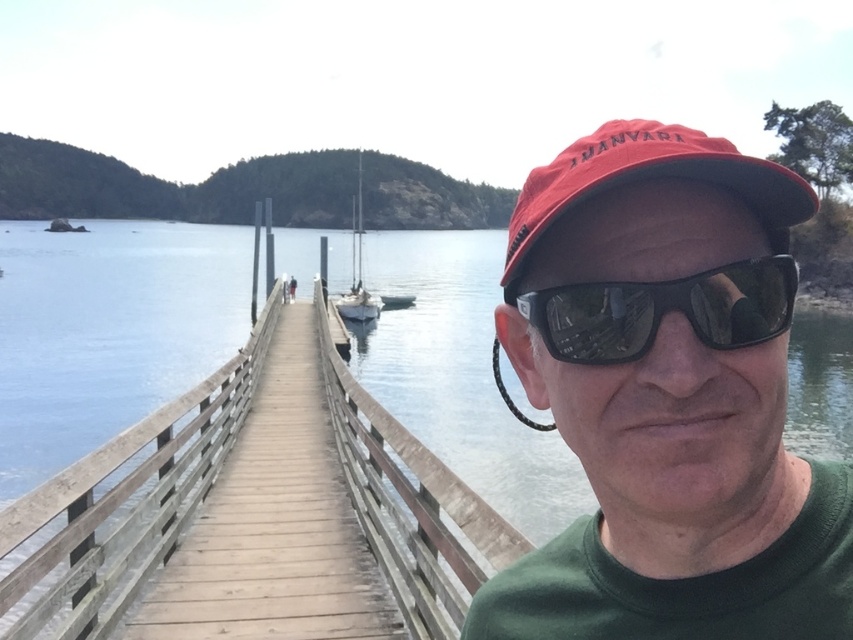
You are a photographer planning to take a photo of the red matte cap at center and the white matte sailboat at center. Which object should you focus on first if you want to capture both in the same frame without moving the camera?

You should focus on the white matte sailboat at center first because it is larger than the red matte cap at center, allowing for better depth of field coverage.

You are standing at the center of the wooden pier and want to place a small decorative item exactly where the wooden at center is located. According to the coordinates given, where should you place the item relative to the pier?

The wooden at center is located at the coordinates point (125, 506), so you should place the item at that exact point on the pier.